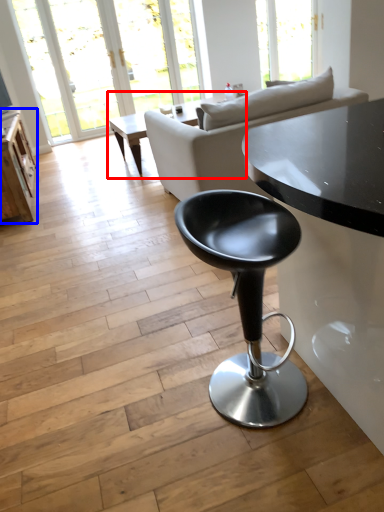
Question: Which object is closer to the camera taking this photo, coffee table (highlighted by a red box) or table (highlighted by a blue box)?

Choices:
 (A) coffee table
 (B) table

Answer: (B)